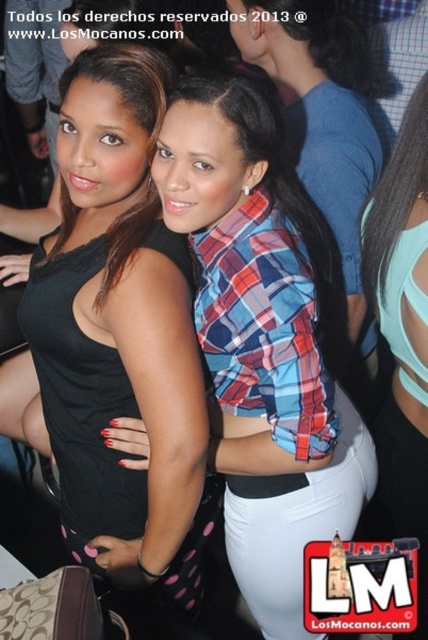
Can you confirm if black matte tank top at center is positioned to the left of plaid fabric shirt at center?

Indeed, black matte tank top at center is positioned on the left side of plaid fabric shirt at center.

Can you confirm if black matte tank top at center is smaller than plaid fabric shirt at center?

Indeed, black matte tank top at center has a smaller size compared to plaid fabric shirt at center.

Is point (67, 346) more distant than point (244, 300)?

That is True.

I want to click on black matte tank top at center, so click(x=121, y=333).

Who is taller, plaid fabric shirt at center or light blue fabric top at center?

With more height is light blue fabric top at center.

Is point (362, 465) closer to camera compared to point (380, 224)?

No, (362, 465) is behind (380, 224).

Find the location of a particular element. plaid fabric shirt at center is located at coordinates (261, 342).

Which of these two, black matte tank top at center or light blue fabric top at center, stands taller?

light blue fabric top at center

Can you confirm if black matte tank top at center is bigger than light blue fabric top at center?

Yes.

Locate an element on the screen. The image size is (428, 640). black matte tank top at center is located at coordinates (121, 333).

Find the location of `black matte tank top at center`. black matte tank top at center is located at coordinates (121, 333).